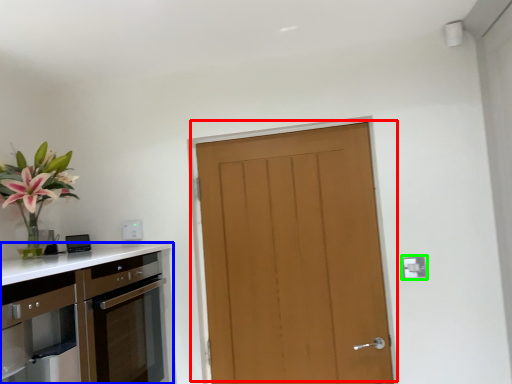
Question: Which is farther away from door (highlighted by a red box)? cabinetry (highlighted by a blue box) or electric outlet (highlighted by a green box)?

Choices:
 (A) cabinetry
 (B) electric outlet

Answer: (A)